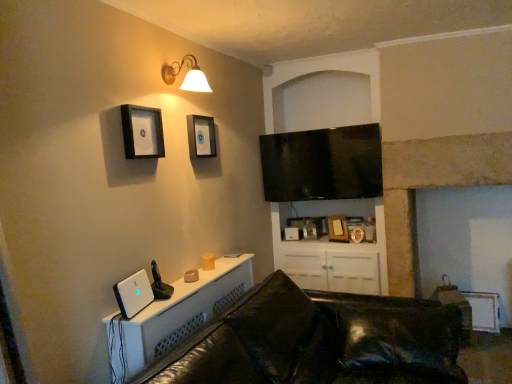
Where is `free spot above white glossy cabinet at lower center (from a real-world perspective)`? The width and height of the screenshot is (512, 384). free spot above white glossy cabinet at lower center (from a real-world perspective) is located at coordinates (184, 288).